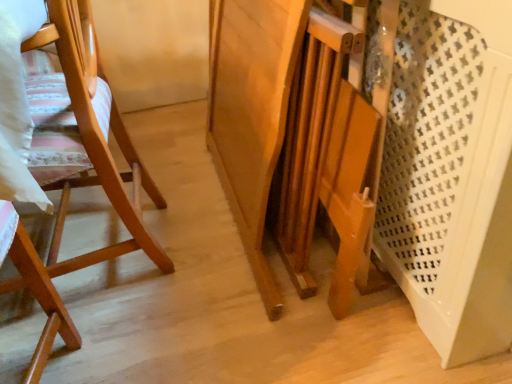
Image resolution: width=512 pixels, height=384 pixels. What do you see at coordinates (84, 137) in the screenshot? I see `wooden chair at left` at bounding box center [84, 137].

This screenshot has width=512, height=384. I want to click on wooden chair at left, so click(84, 137).

The image size is (512, 384). I want to click on wooden chair at left, so (x=84, y=137).